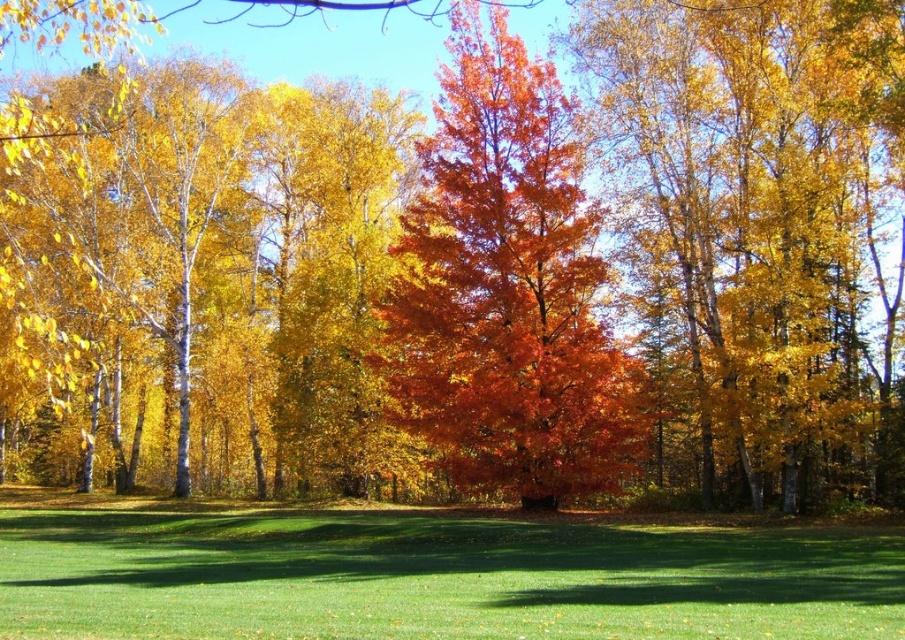
You are standing at the camera position looking at the green grass at center. If you walk straight towards it, how far will you have to walk to reach it?

The green grass at center is 30.35 feet away from the camera position, so you will have to walk 30.35 feet to reach it.

You are a gardener trying to water the green grass at center and the shiny orange leaves at center. Which object should you water first if you want to start from the lower part of the scene?

You should water the green grass at center first because it is located below the shiny orange leaves at center, so it is lower in the scene.